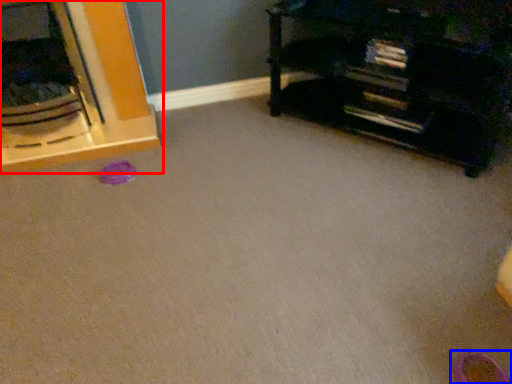
Question: Which object is further to the camera taking this photo, furniture (highlighted by a red box) or shoe (highlighted by a blue box)?

Choices:
 (A) furniture
 (B) shoe

Answer: (A)